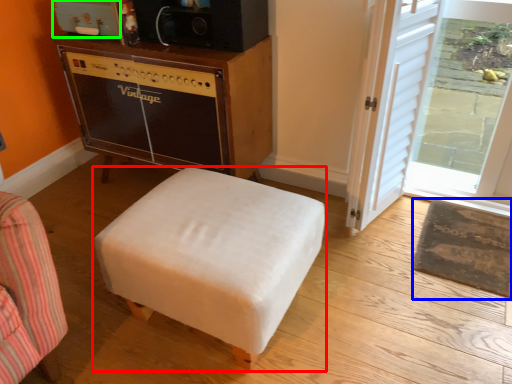
Question: Which object is the farthest from furniture (highlighted by a red box)? Choose among these: mat (highlighted by a blue box) or appliance (highlighted by a green box).

Choices:
 (A) mat
 (B) appliance

Answer: (B)